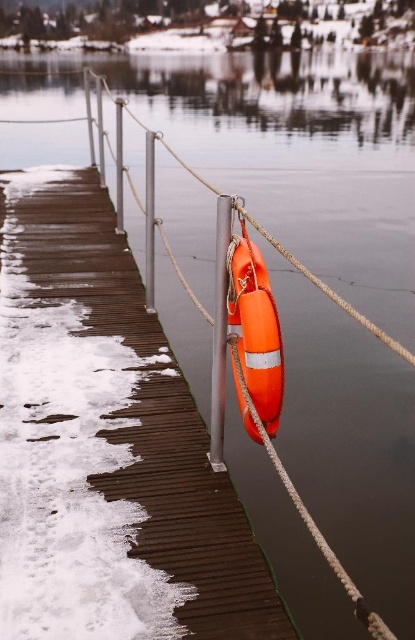
Based on the photo, does orange rubber lifebuoy at center come behind smooth gray pole at center?

Yes, orange rubber lifebuoy at center is further from the viewer.

Can you confirm if orange rubber lifebuoy at center is wider than smooth gray pole at center?

Correct, the width of orange rubber lifebuoy at center exceeds that of smooth gray pole at center.

What do you see at coordinates (148, 413) in the screenshot?
I see `orange rubber lifebuoy at center` at bounding box center [148, 413].

Where is `orange rubber lifebuoy at center`? This screenshot has height=640, width=415. orange rubber lifebuoy at center is located at coordinates (148, 413).